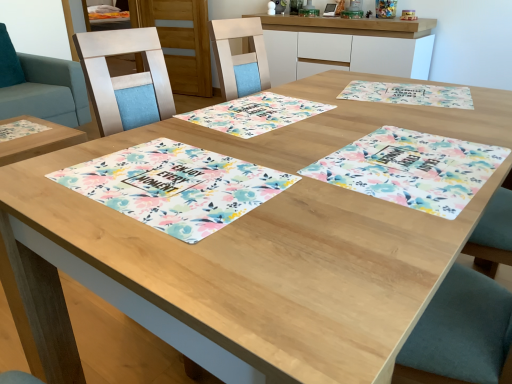
The height and width of the screenshot is (384, 512). Identify the location of spots to the right of floral fabric placemat at center, which is counted as the 4th place mat, starting from the right. (346, 177).